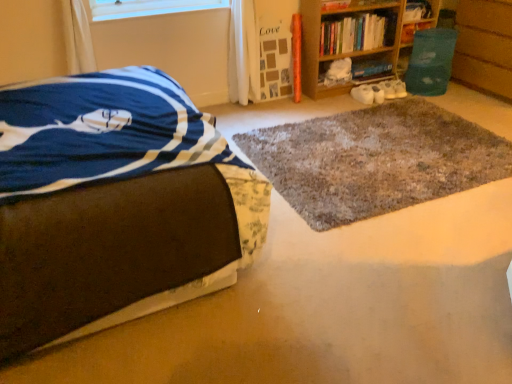
Question: Is green plastic bin at right taller or shorter than hardcover book at upper right, positioned as the third book in left-to-right order?

Choices:
 (A) short
 (B) tall

Answer: (B)

Question: From the image's perspective, relative to hardcover book at upper right, positioned as the third book in left-to-right order, is green plastic bin at right above or below?

Choices:
 (A) below
 (B) above

Answer: (A)

Question: Which object is positioned closest to the hardcover book at center, the third book viewed from the right?

Choices:
 (A) wooden bookshelf at upper right
 (B) hardcover book at upper right, which is the 4th book in left-to-right order
 (C) brown fabric bed at left
 (D) green plastic bin at right
 (E) hardcover book at upper right, the second book in the right-to-left sequence

Answer: (A)

Question: Which object is positioned farthest from the brown fabric bed at left?

Choices:
 (A) wooden bookshelf at upper right, which appears as the first book when viewed from the left
 (B) hardcover book at upper right, the second book in the right-to-left sequence
 (C) transparent plastic window screen at upper center
 (D) shaggy gray rug at center
 (E) green plastic bin at right

Answer: (E)